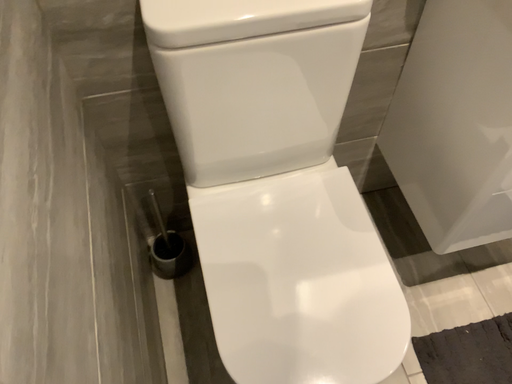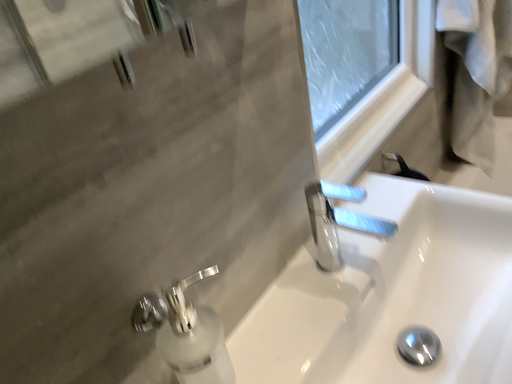
Question: Which way did the camera rotate in the video?

Choices:
 (A) rotated upward
 (B) rotated downward

Answer: (A)